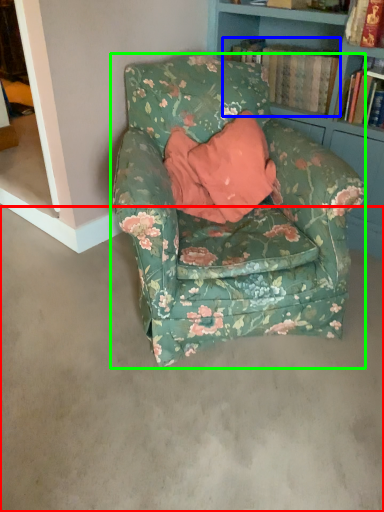
Question: Considering the real-world distances, which object is farthest from concrete (highlighted by a red box)? book (highlighted by a blue box) or chair (highlighted by a green box)?

Choices:
 (A) book
 (B) chair

Answer: (A)